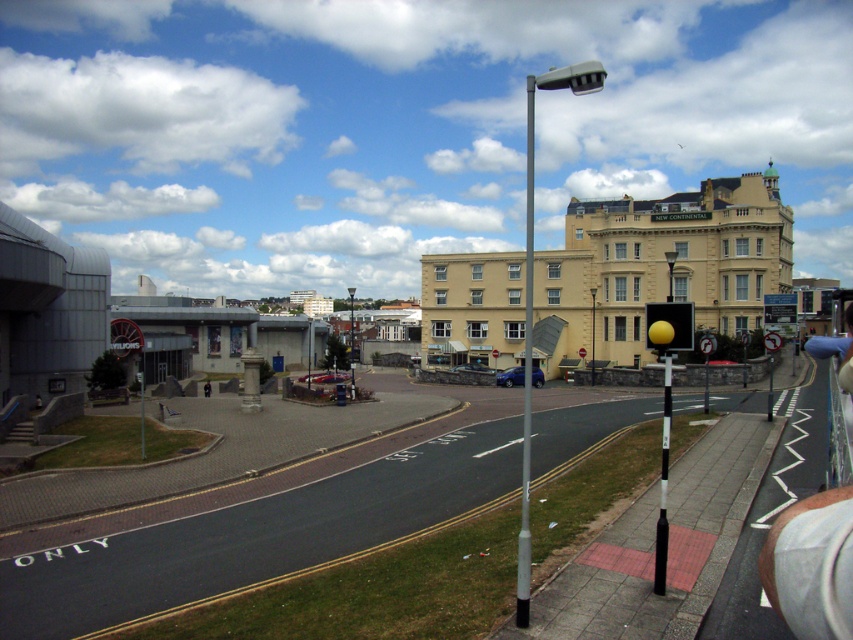
Question: Considering the real-world distances, which object is closest to the yellow matte traffic light at center?

Choices:
 (A) metallic pole at center
 (B) silver metallic pole at center

Answer: (A)

Question: Can you confirm if silver metallic pole at center is positioned to the right of black plastic pole at right?

Choices:
 (A) no
 (B) yes

Answer: (B)

Question: Is black plastic pole at right bigger than yellow matte traffic light at center?

Choices:
 (A) no
 (B) yes

Answer: (A)

Question: Among these points, which one is nearest to the camera?

Choices:
 (A) (526, 257)
 (B) (689, 332)
 (C) (663, 493)

Answer: (B)

Question: Which point appears closest to the camera in this image?

Choices:
 (A) (685, 348)
 (B) (531, 180)
 (C) (663, 570)

Answer: (A)

Question: Can you confirm if black plastic pole at right is wider than metallic pole at center?

Choices:
 (A) yes
 (B) no

Answer: (B)